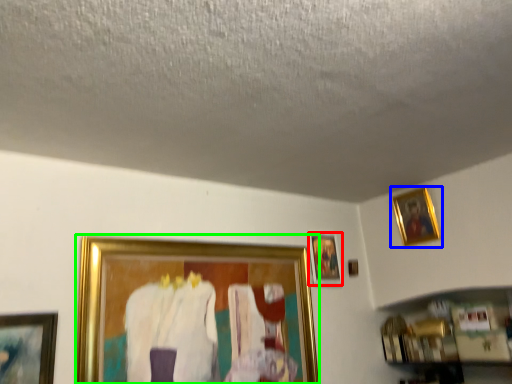
Question: Based on their relative distances, which object is nearer to picture frame (highlighted by a red box)? Choose from picture frame (highlighted by a blue box) and picture frame (highlighted by a green box).

Choices:
 (A) picture frame
 (B) picture frame

Answer: (B)